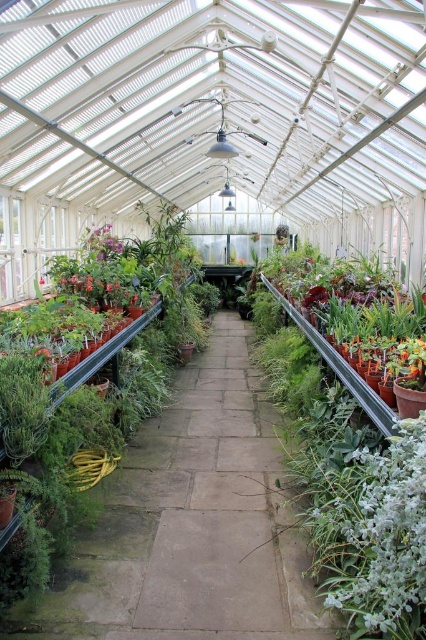
Does green matte plant at left appear under pink matte flower at center?

Yes.

Between green matte plant at left and pink matte flower at center, which one appears on the right side from the viewer's perspective?

Positioned to the right is green matte plant at left.

You are a GUI agent. You are given a task and a screenshot of the screen. Output one action in this format:
    pyautogui.click(x=<x>, y=<y>)
    Task: Click on the green matte plant at left
    The image size is (426, 640).
    Given the screenshot: What is the action you would take?
    pyautogui.click(x=86, y=392)

In the scene shown: Between green succulent at right and pink matte flower at center, which one appears on the left side from the viewer's perspective?

pink matte flower at center

Can you confirm if green succulent at right is shorter than pink matte flower at center?

Incorrect, green succulent at right's height does not fall short of pink matte flower at center's.

Who is more forward, (362, 413) or (92, 252)?

Point (362, 413)

The width and height of the screenshot is (426, 640). In order to click on green succulent at right in this screenshot , I will do `click(351, 435)`.

Does green succulent at right appear over green matte plant at left?

Incorrect, green succulent at right is not positioned above green matte plant at left.

Is point (316, 273) closer to viewer compared to point (63, 477)?

That is False.

The height and width of the screenshot is (640, 426). In order to click on green succulent at right in this screenshot , I will do `click(351, 435)`.